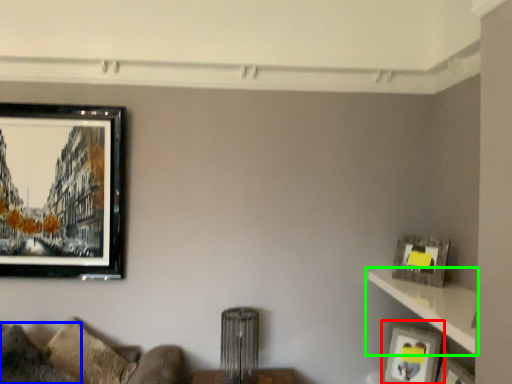
Question: Which is nearer to the picture frame (highlighted by a red box)? pillow (highlighted by a blue box) or shelf (highlighted by a green box).

Choices:
 (A) pillow
 (B) shelf

Answer: (B)